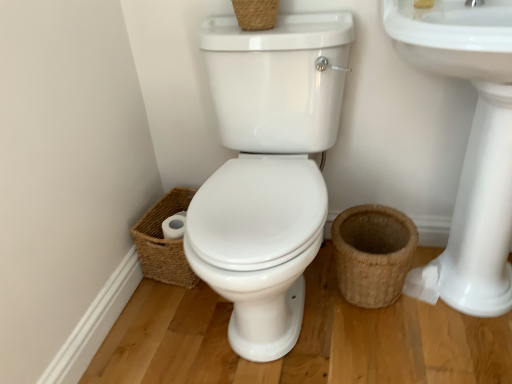
I want to click on blank area beneath white ceramic sink at right, positioned as the first sink in right-to-left order (from a real-world perspective), so click(448, 310).